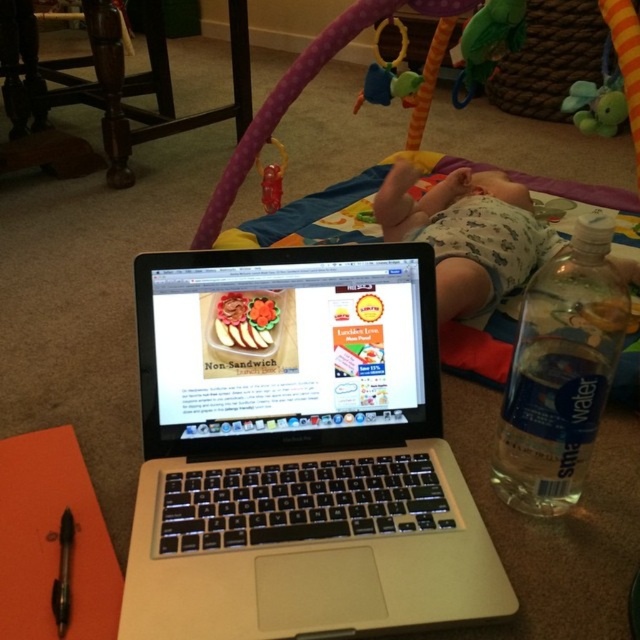
Question: Which point is farther from the camera taking this photo?

Choices:
 (A) (410, 77)
 (B) (205, 451)
 (C) (598, 102)

Answer: (A)

Question: From the image, what is the correct spatial relationship of silver/black plastic laptop at center in relation to green rubber teether at upper center?

Choices:
 (A) below
 (B) above

Answer: (A)

Question: In this image, where is green rubber teether at upper center located relative to translucent plastic teething ring at upper center?

Choices:
 (A) below
 (B) above

Answer: (B)

Question: Among these points, which one is farthest from the camera?

Choices:
 (A) (380, 428)
 (B) (522, 36)

Answer: (B)

Question: Can you confirm if green rubber teether at upper center is thinner than green matte teether at upper right?

Choices:
 (A) no
 (B) yes

Answer: (A)

Question: Among these points, which one is farthest from the camera?

Choices:
 (A) (538, 253)
 (B) (576, 93)
 (C) (282, 266)
 (D) (381, 84)

Answer: (D)